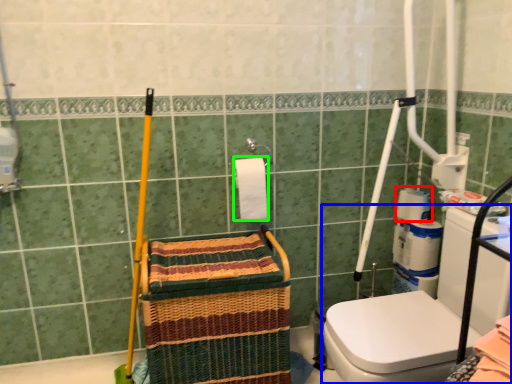
Question: Which object is positioned farthest from toilet paper (highlighted by a red box)? Select from washer (highlighted by a blue box) and toilet paper (highlighted by a green box).

Choices:
 (A) washer
 (B) toilet paper

Answer: (B)